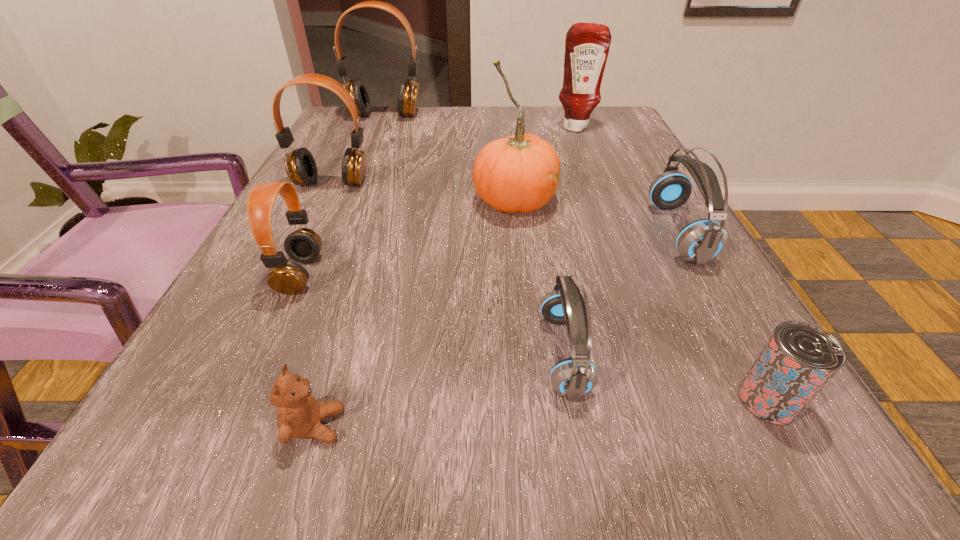
The image size is (960, 540). Identify the location of free spot between the second farthest brown headset and the beer can. (550, 292).

Identify the location of unoccupied area between the farthest headset and the shortest headset. The height and width of the screenshot is (540, 960). (474, 235).

Identify the location of object that stands as the sixth closest to the seventh object from left to right. (303, 245).

I want to click on the sixth closest object to the second farthest brown headset, so click(299, 414).

Select which headset is the fourth closest to the condiment. Please provide its 2D coordinates. Your answer should be formatted as a tuple, i.e. [(x, y)], where the tuple contains the x and y coordinates of a point satisfying the conditions above.

[(574, 377)]

Choose which headset is the fifth nearest neighbor to the beer can. Please provide its 2D coordinates. Your answer should be formatted as a tuple, i.e. [(x, y)], where the tuple contains the x and y coordinates of a point satisfying the conditions above.

[(408, 91)]

Image resolution: width=960 pixels, height=540 pixels. Identify the location of brown headset that is the second closest one to the smallest brown headset. (408, 91).

Locate an element on the screen. the second closest brown headset to the second farthest brown headset is located at coordinates (408, 91).

Where is `free space that satisfies the following two spatial constraints: 1. on the ear cups of the second headset from right to left; 2. on the left side of the beer can`? This screenshot has width=960, height=540. free space that satisfies the following two spatial constraints: 1. on the ear cups of the second headset from right to left; 2. on the left side of the beer can is located at coordinates (572, 400).

The image size is (960, 540). Identify the location of vacant region that satisfies the following two spatial constraints: 1. on the ear cups of the tallest headset; 2. on the ear cups of the smallest brown headset. (322, 274).